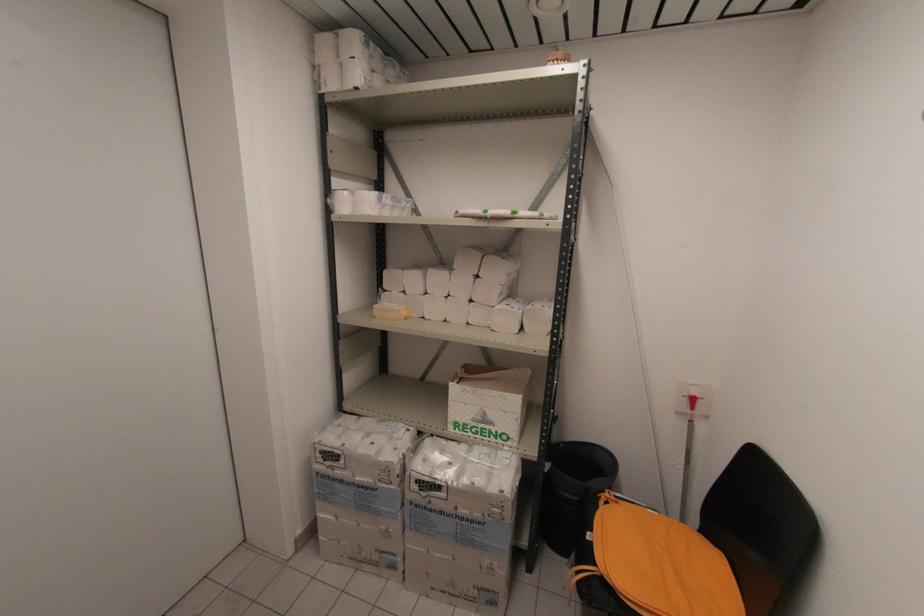
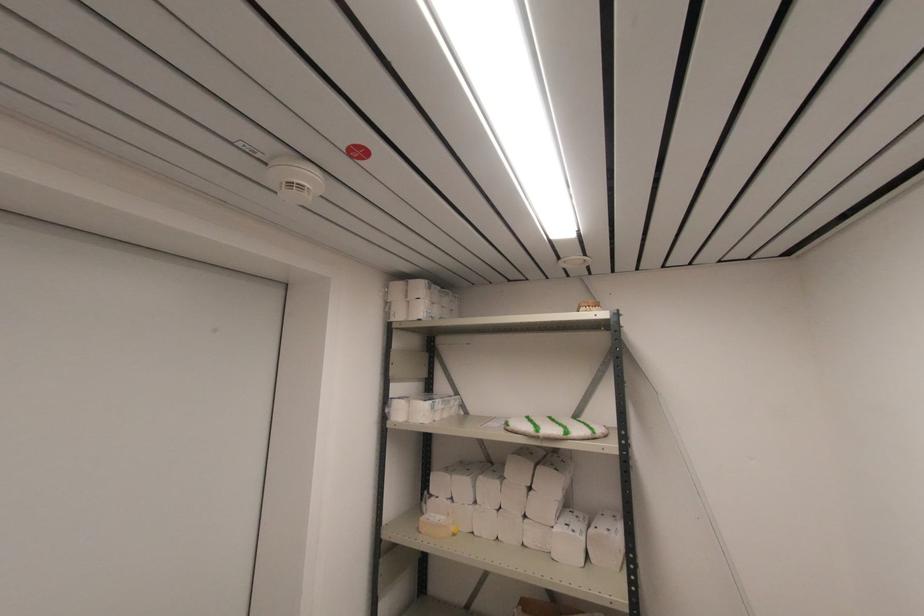
Find the pixel in the second image that matches point 558,61 in the first image.

(590, 307)